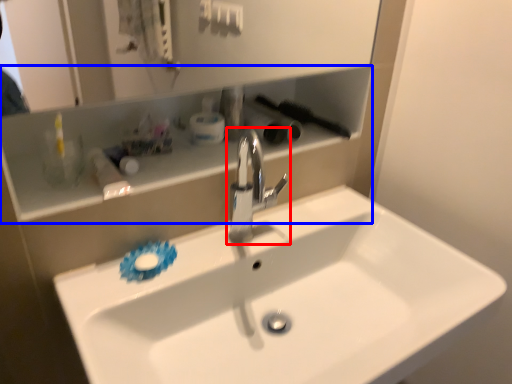
Question: Which point is closer to the camera, tap (highlighted by a red box) or shelve (highlighted by a blue box)?

Choices:
 (A) tap
 (B) shelve

Answer: (B)